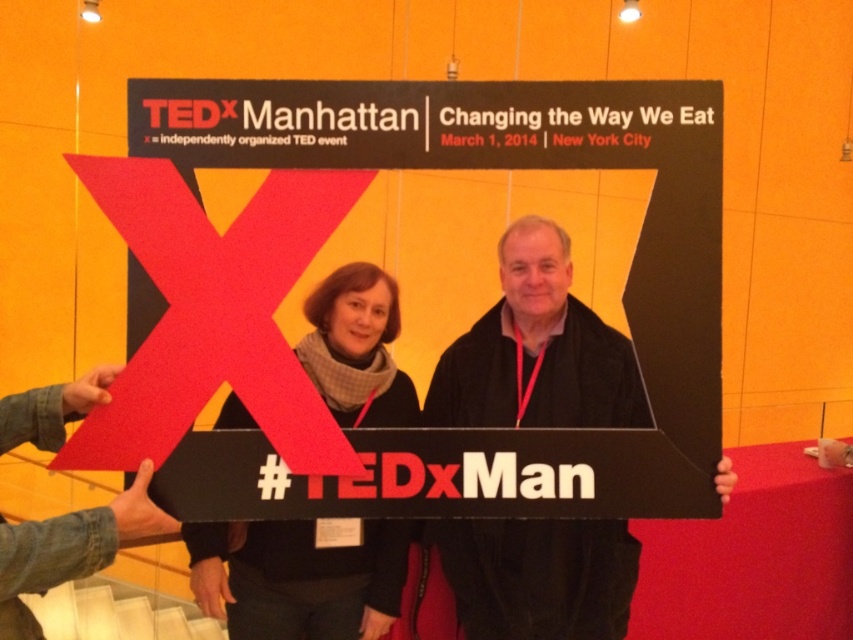
Question: Is black matte sign at center bigger than matte black scarf at center?

Choices:
 (A) no
 (B) yes

Answer: (B)

Question: Observing the image, what is the correct spatial positioning of black matte sign at center in reference to matte black scarf at center?

Choices:
 (A) left
 (B) right

Answer: (B)

Question: Which of the following is the farthest from the observer?

Choices:
 (A) (364, 621)
 (B) (480, 570)

Answer: (A)

Question: Which point is farther to the camera?

Choices:
 (A) (567, 632)
 (B) (376, 269)

Answer: (B)

Question: Does black matte sign at center have a lesser width compared to matte black scarf at center?

Choices:
 (A) yes
 (B) no

Answer: (B)